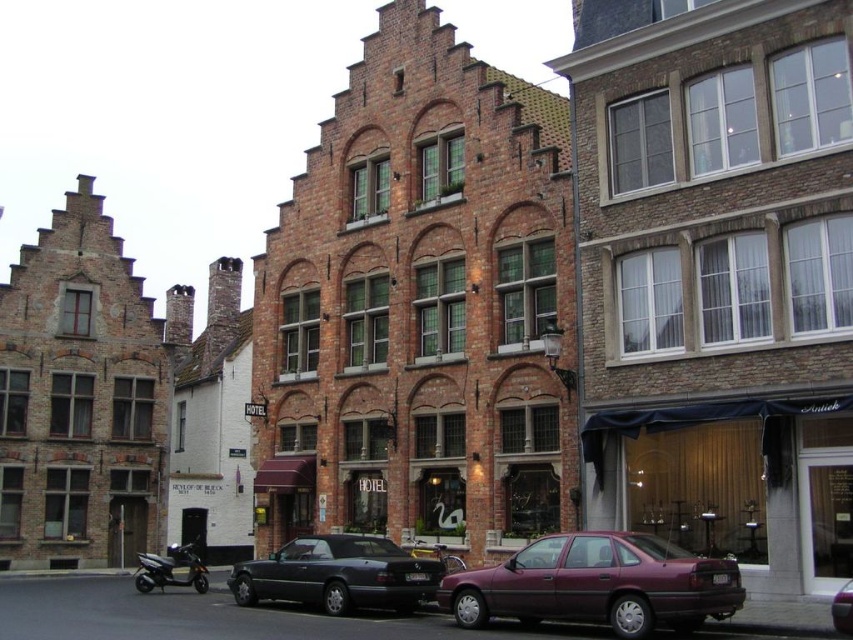
You are a delivery person who needs to park your scooter near the metallic maroon sedan at center without blocking the entrance of the hotel. The parking zone allows vehicles to be parked within 50 meters of the sedan. Is the shiny black scooter at lower left parked within the allowed distance?

The distance between the shiny black scooter at lower left and the metallic maroon sedan at center is 41.81 meters, which is within the 50 meters parking zone limit. Therefore, the shiny black scooter at lower left is parked within the allowed distance.

You are a delivery person who needs to park your vehicle in the parking spot marked with a yellow line at the lower center of the image. The parking spot is 2 meters wide. You have a choice between driving the maroon metallic car at lower right or the shiny black scooter at lower left. Which vehicle would you choose to ensure it fits in the parking spot?

The parking spot is 2 meters wide. The maroon metallic car at lower right might be wider than the shiny black scooter at lower left. Therefore, the shiny black scooter at lower left is more likely to fit in the parking spot.

You are standing at the entrance of the HOTEL building. You want to park your car at the point closest to the building entrance. Is the maroon metallic car at lower right blocking your parking spot?

The maroon metallic car at lower right is located at point (596, 584), which is far from the entrance of the HOTEL building. Therefore, it is not blocking your parking spot.